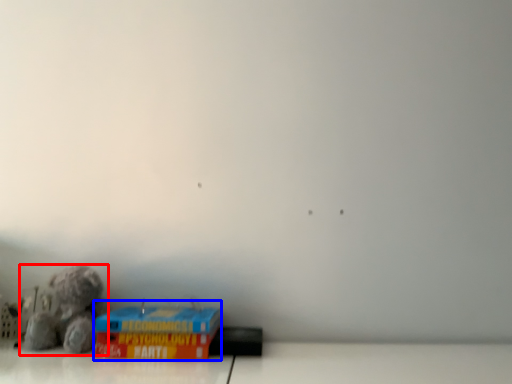
Question: Which object appears farthest to the camera in this image, toy (highlighted by a red box) or cardboard box (highlighted by a blue box)?

Choices:
 (A) toy
 (B) cardboard box

Answer: (A)